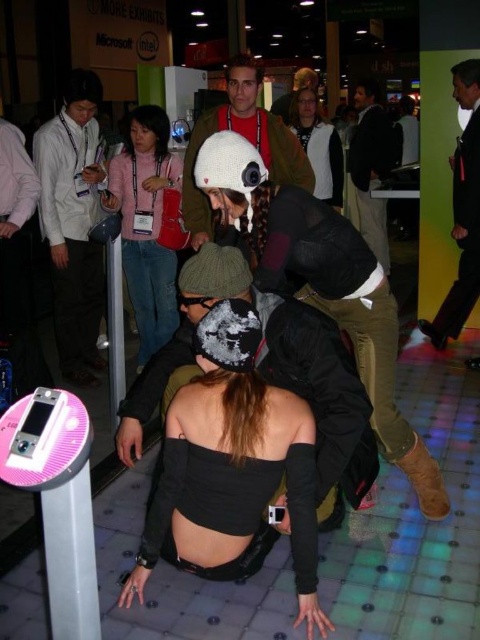
Who is higher up, white knitted hat at center or black leather jacket at upper right?

white knitted hat at center is above.

Is white knitted hat at center thinner than black leather jacket at upper right?

In fact, white knitted hat at center might be wider than black leather jacket at upper right.

Which is in front, point (303, 154) or point (478, 182)?

Positioned in front is point (303, 154).

Where is `white knitted hat at center`? This screenshot has height=640, width=480. white knitted hat at center is located at coordinates (243, 138).

Who is more distant from viewer, (159, 259) or (463, 198)?

The point (159, 259) is behind.

Image resolution: width=480 pixels, height=640 pixels. I want to click on pink fabric purse at center, so click(x=145, y=225).

Who is taller, black matte top at center or matte white jacket at upper center?

Standing taller between the two is matte white jacket at upper center.

Is black matte top at center wider than matte white jacket at upper center?

Correct, the width of black matte top at center exceeds that of matte white jacket at upper center.

Is point (248, 544) positioned after point (313, 113)?

No, it is in front of (313, 113).

Where is `black matte top at center`? Image resolution: width=480 pixels, height=640 pixels. black matte top at center is located at coordinates (233, 456).